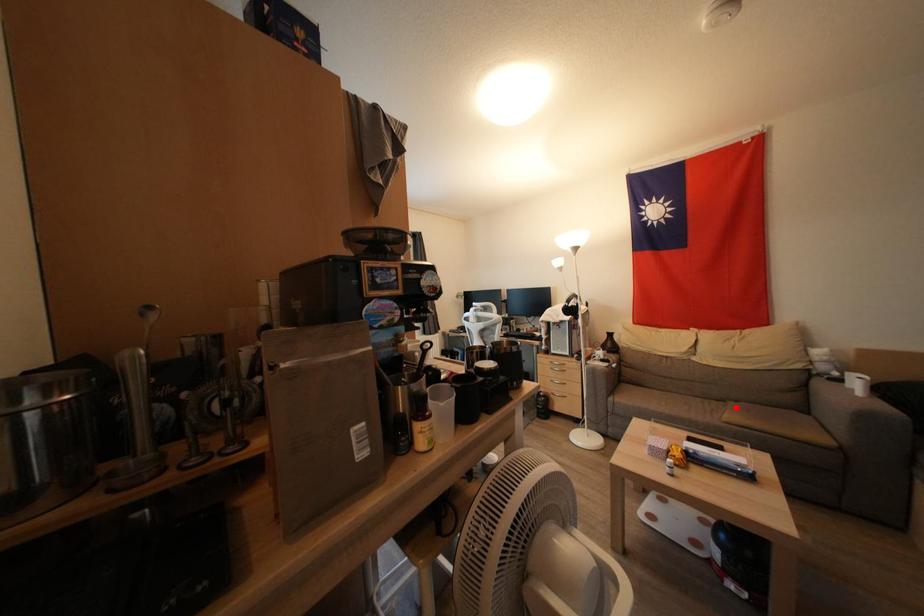
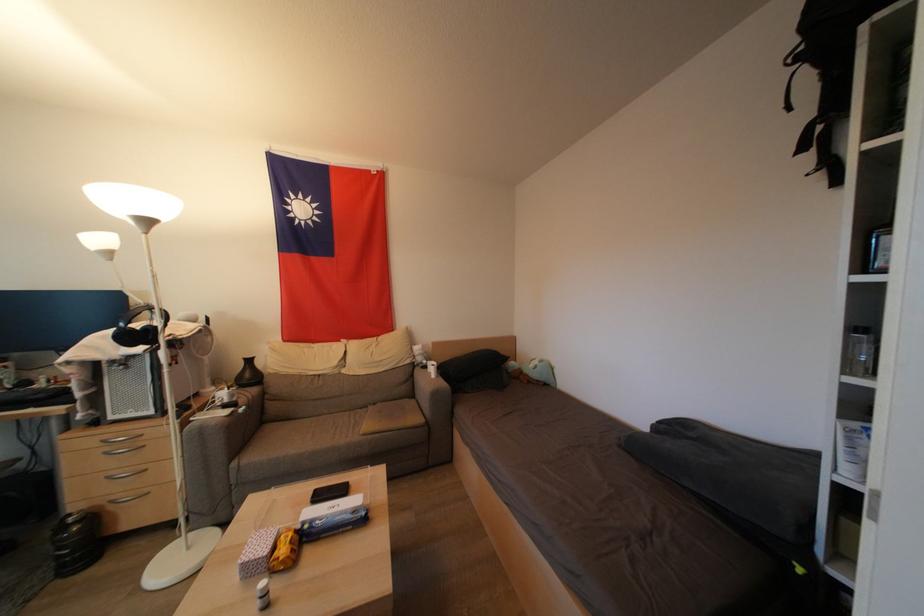
Question: A red point is marked in image1. In image2, is the corresponding 3D point closer to the camera or farther? Reply with the corresponding letter.

Choices:
 (A) The corresponding 3D point is closer.
 (B) The corresponding 3D point is farther.

Answer: (B)